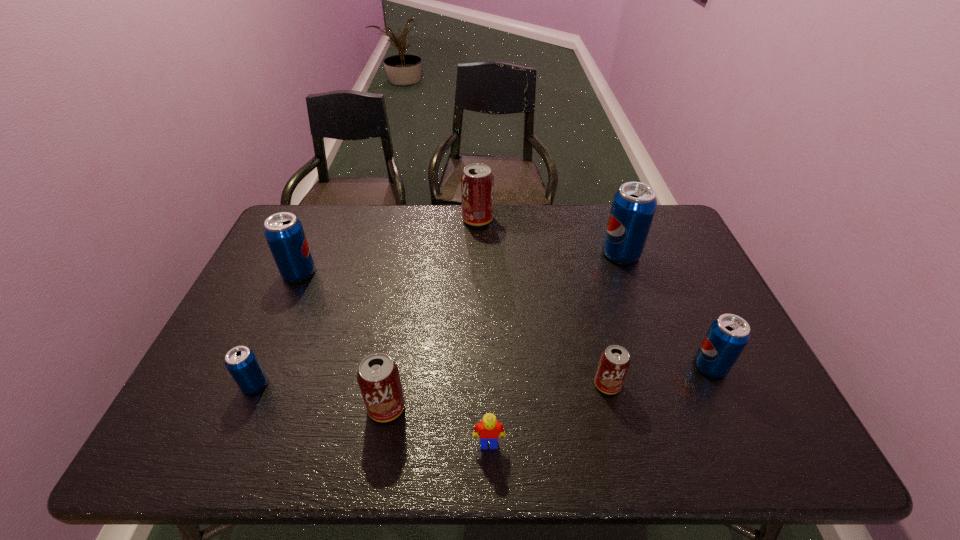
Image resolution: width=960 pixels, height=540 pixels. I want to click on free space located 0.160m on the right of the sixth object from left to right, so click(x=687, y=384).

Find the location of a particular element. Image resolution: width=960 pixels, height=540 pixels. soda can at the near edge is located at coordinates (378, 376).

This screenshot has width=960, height=540. Identify the location of Lego that is at the near edge. (489, 429).

I want to click on object located at the right edge, so click(728, 335).

The image size is (960, 540). In order to click on free point at the far edge in this screenshot , I will do `click(380, 214)`.

You are a GUI agent. You are given a task and a screenshot of the screen. Output one action in this format:
    pyautogui.click(x=<x>, y=<y>)
    Task: Click on the free space at the near edge
    
    Given the screenshot: What is the action you would take?
    pyautogui.click(x=348, y=428)

Identify the location of free space at the left edge. (266, 329).

Locate an element on the screen. The width and height of the screenshot is (960, 540). vacant space at the far left corner is located at coordinates (310, 220).

Image resolution: width=960 pixels, height=540 pixels. What are the coordinates of `free space at the near left corner of the desktop` in the screenshot? It's located at (200, 427).

The image size is (960, 540). I want to click on free spot between the smallest blue pop soda and the leftmost red soda can, so click(x=321, y=396).